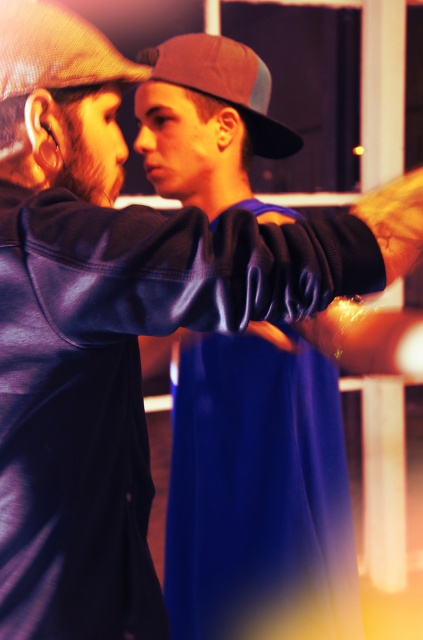
You are a photographer adjusting the focus on your camera. You notice two baseball caps in the frame. The matte brown baseball cap at upper left and the brown mesh baseball cap at center. Which one should you focus on if you want to capture the larger cap in sharp detail?

The brown mesh baseball cap at center is larger than the matte brown baseball cap at upper left, so you should focus on the brown mesh baseball cap at center to capture it in sharp detail.